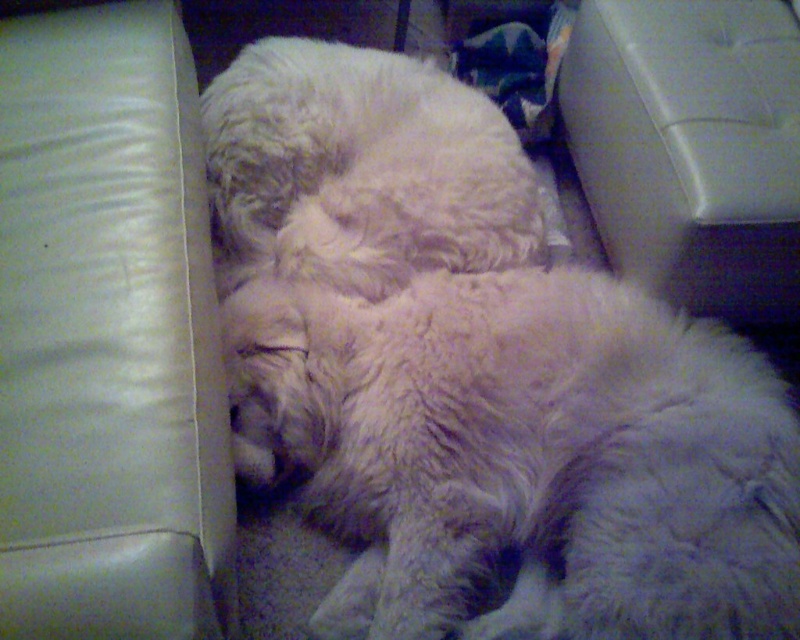
Looking at this image, you are a photographer trying to capture a closeup shot of the fluffy white cat at center and the fuzzy white dog at center. Since you want both animals to appear equally large in the photo, which animal should you move closer to the camera?

To make both the fluffy white cat at center and the fuzzy white dog at center appear equally large in the photo, you should move the fuzzy white dog at center closer to the camera because the fluffy white cat at center is wider. Moving the smaller animal closer can help balance their sizes in the frame.